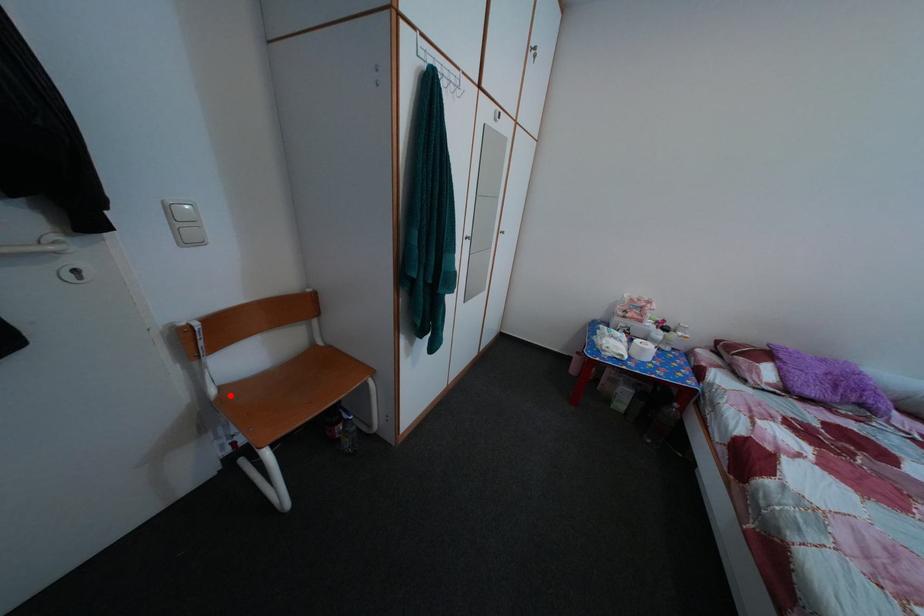
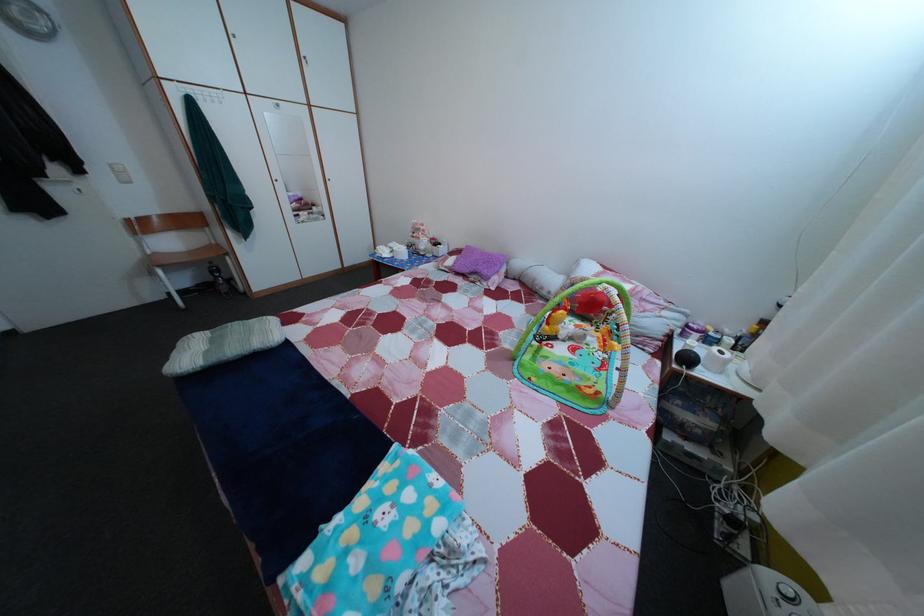
Where in the second image is the point corresponding to the highlighted location from the first image?

(164, 261)